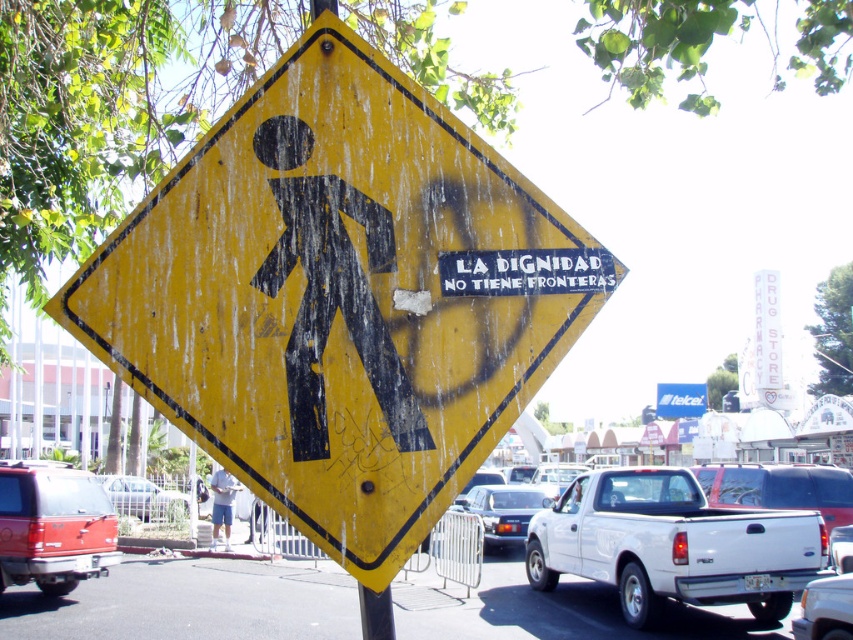
You are a pedestrian standing at the point labeled point (x=70, y=499) and want to walk to the point labeled point (x=846, y=627). Given the scene described, which direction should you move to reach your destination?

Since point (x=70, y=499) is behind point (x=846, y=627), you should move forward to reach your destination.